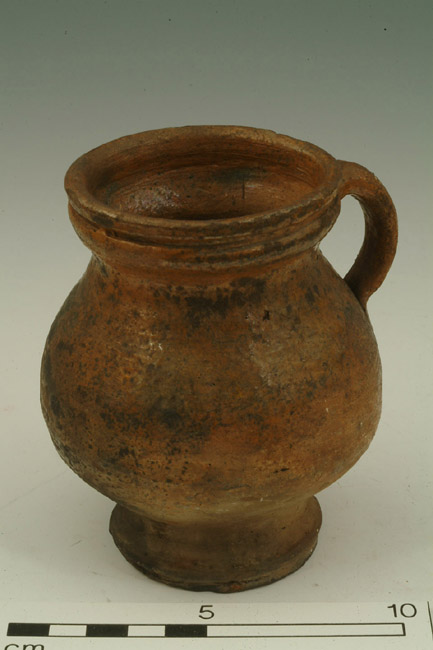
Identify the location of base of urn. This screenshot has height=650, width=433. (242, 580).